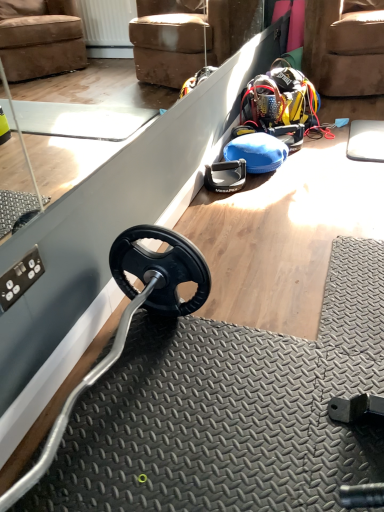
The height and width of the screenshot is (512, 384). I want to click on brown suede armchair at upper right, so click(x=343, y=49).

The image size is (384, 512). Describe the element at coordinates (343, 49) in the screenshot. I see `brown suede armchair at upper right` at that location.

Describe the element at coordinates (225, 176) in the screenshot. I see `black rubber weight at center` at that location.

Image resolution: width=384 pixels, height=512 pixels. Find the location of `black rubber weight at center`. black rubber weight at center is located at coordinates (225, 176).

Measure the distance between point (213, 163) and camera.

Point (213, 163) is 6.81 feet away from camera.

Image resolution: width=384 pixels, height=512 pixels. I want to click on brown suede armchair at upper right, so click(x=343, y=49).

Which object is positioned more to the right, brown suede armchair at upper right or black rubber weight at center?

brown suede armchair at upper right is more to the right.

Considering their positions, is brown suede armchair at upper right located in front of or behind black rubber weight at center?

brown suede armchair at upper right is behind black rubber weight at center.

Is point (346, 59) farther from viewer compared to point (240, 184)?

Yes, point (346, 59) is farther from viewer.

From the image's perspective, does brown suede armchair at upper right appear higher than black rubber weight at center?

Yes.

From a real-world perspective, is brown suede armchair at upper right physically located above or below black rubber weight at center?

Clearly, from a real-world perspective, brown suede armchair at upper right is above black rubber weight at center.

Which of these two, brown suede armchair at upper right or black rubber weight at center, is thinner?

Thinner between the two is black rubber weight at center.

In terms of height, does brown suede armchair at upper right look taller or shorter compared to black rubber weight at center?

Considering their sizes, brown suede armchair at upper right has more height than black rubber weight at center.

Is brown suede armchair at upper right bigger or smaller than black rubber weight at center?

Clearly, brown suede armchair at upper right is larger in size than black rubber weight at center.

Is brown suede armchair at upper right inside or outside of black rubber weight at center?

brown suede armchair at upper right is outside black rubber weight at center.

Is brown suede armchair at upper right directly adjacent to black rubber weight at center?

brown suede armchair at upper right and black rubber weight at center are not in contact.

Could you tell me if brown suede armchair at upper right is facing black rubber weight at center?

No, brown suede armchair at upper right is not oriented towards black rubber weight at center.

How different are the orientations of brown suede armchair at upper right and black rubber weight at center in degrees?

The angular difference between brown suede armchair at upper right and black rubber weight at center is 68.4 degrees.

Identify the location of wheel that appears in front of the brown suede armchair at upper right. Image resolution: width=384 pixels, height=512 pixels. (225, 176).

From the picture: Which object is positioned more to the left, black rubber weight at center or brown suede armchair at upper right?

Positioned to the left is black rubber weight at center.

Which object is further away from the camera taking this photo, black rubber weight at center or brown suede armchair at upper right?

brown suede armchair at upper right is further from the camera.

Which point is more forward, (227, 170) or (353, 15)?

The point (227, 170) is more forward.

From the image's perspective, is black rubber weight at center on brown suede armchair at upper right?

Incorrect, from the image's perspective, black rubber weight at center is lower than brown suede armchair at upper right.

From a real-world perspective, is black rubber weight at center physically above brown suede armchair at upper right?

Incorrect, from a real-world perspective, black rubber weight at center is lower than brown suede armchair at upper right.

Based on the photo, which of these two, black rubber weight at center or brown suede armchair at upper right, is thinner?

Thinner between the two is black rubber weight at center.

Who is shorter, black rubber weight at center or brown suede armchair at upper right?

With less height is black rubber weight at center.

In the scene shown: Is black rubber weight at center bigger or smaller than brown suede armchair at upper right?

Clearly, black rubber weight at center is smaller in size than brown suede armchair at upper right.

Would you say brown suede armchair at upper right is part of black rubber weight at center's contents?

No.

Are black rubber weight at center and brown suede armchair at upper right far apart?

black rubber weight at center is positioned a significant distance from brown suede armchair at upper right.

Is brown suede armchair at upper right at the back of black rubber weight at center?

No, black rubber weight at center is not facing away from brown suede armchair at upper right.

How far apart are black rubber weight at center and brown suede armchair at upper right?

black rubber weight at center and brown suede armchair at upper right are 4.77 feet apart from each other.

Locate an element on the screen. wheel in front of the brown suede armchair at upper right is located at coordinates (225, 176).

Identify the location of armchair on the right side of black rubber weight at center. Image resolution: width=384 pixels, height=512 pixels. (343, 49).

At what (x,y) coordinates should I click in order to perform the action: click on wheel below the brown suede armchair at upper right (from the image's perspective). Please return your answer as a coordinate pair (x, y). The width and height of the screenshot is (384, 512). Looking at the image, I should click on (225, 176).